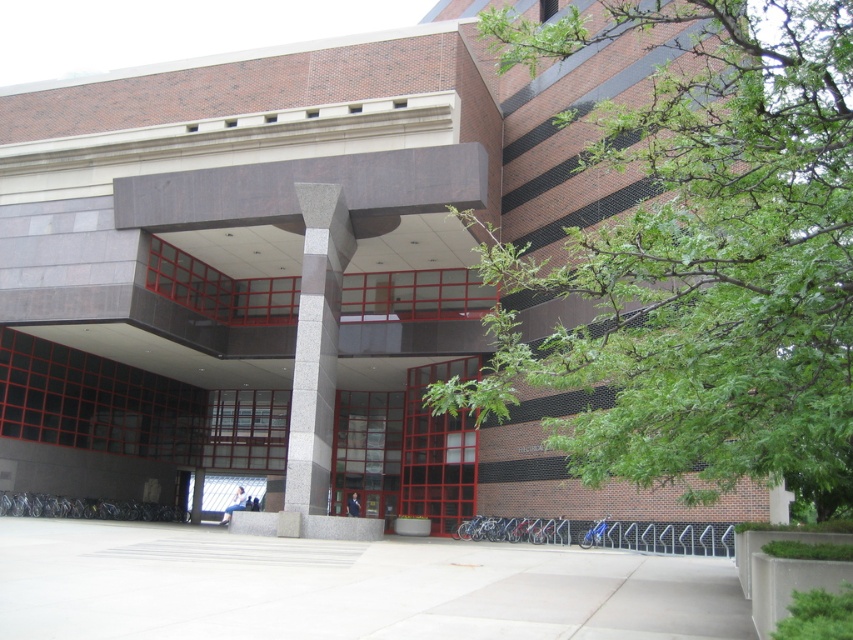
Between green leafy tree at upper right and glass door at center, which one is positioned lower?

glass door at center is below.

How much distance is there between green leafy tree at upper right and glass door at center?

green leafy tree at upper right is 39.49 feet from glass door at center.

Who is more distant from viewer, (x=776, y=106) or (x=331, y=484)?

Point (x=331, y=484)

This screenshot has height=640, width=853. I want to click on green leafy tree at upper right, so click(699, 257).

Is red glass door at center below glass door at center?

Correct, red glass door at center is located below glass door at center.

Is point (404, 483) positioned before point (367, 396)?

Yes, point (404, 483) is closer to viewer.

The height and width of the screenshot is (640, 853). I want to click on red glass door at center, so click(x=437, y=451).

Is granite column at center wider than glass door at center?

Incorrect, granite column at center's width does not surpass glass door at center's.

Between granite column at center and glass door at center, which one has less height?

glass door at center

Between point (337, 276) and point (352, 452), which one is positioned in front?

Positioned in front is point (337, 276).

This screenshot has height=640, width=853. Find the location of `granite column at center`. granite column at center is located at coordinates (316, 346).